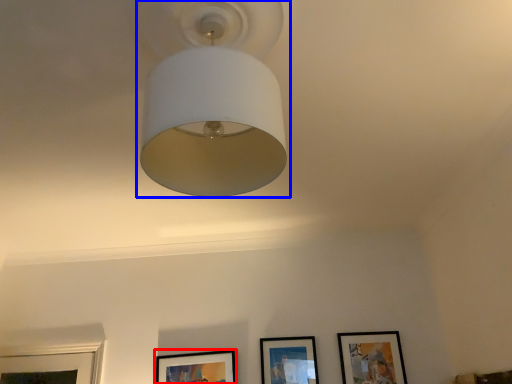
Question: Which point is further to the camera, picture frame (highlighted by a red box) or lamp (highlighted by a blue box)?

Choices:
 (A) picture frame
 (B) lamp

Answer: (A)